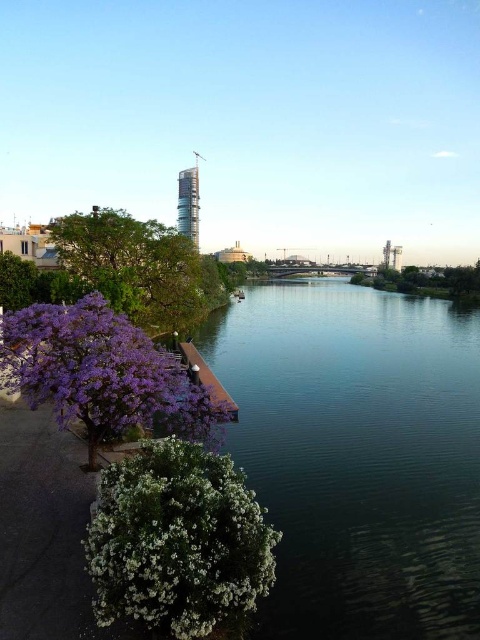
Question: Which of these objects is positioned closest to the white fluffy bush at lower left?

Choices:
 (A) green leafy tree at left
 (B) dark blue water at center

Answer: (A)

Question: Observing the image, what is the correct spatial positioning of white fluffy bush at lower left in reference to green leafy tree at left?

Choices:
 (A) below
 (B) above

Answer: (A)

Question: Which object appears closest to the camera in this image?

Choices:
 (A) dark blue water at center
 (B) white fluffy bush at lower left

Answer: (B)

Question: Does dark blue water at center come behind white fluffy bush at lower left?

Choices:
 (A) yes
 (B) no

Answer: (A)

Question: Does dark blue water at center appear under green leafy tree at left?

Choices:
 (A) no
 (B) yes

Answer: (B)

Question: Considering the real-world distances, which object is closest to the green leafy tree at left?

Choices:
 (A) white fluffy bush at lower left
 (B) dark blue water at center

Answer: (B)